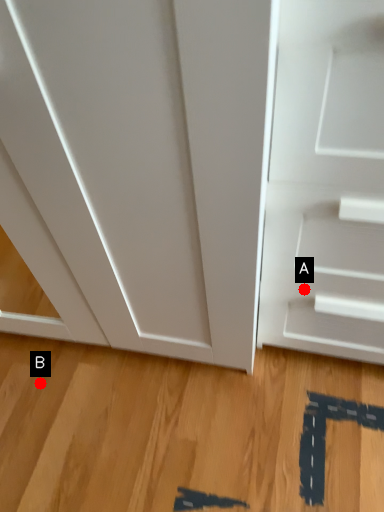
Question: Two points are circled on the image, labeled by A and B beside each circle. Which of the following is the farthest from the observer?

Choices:
 (A) A is further
 (B) B is further

Answer: (B)